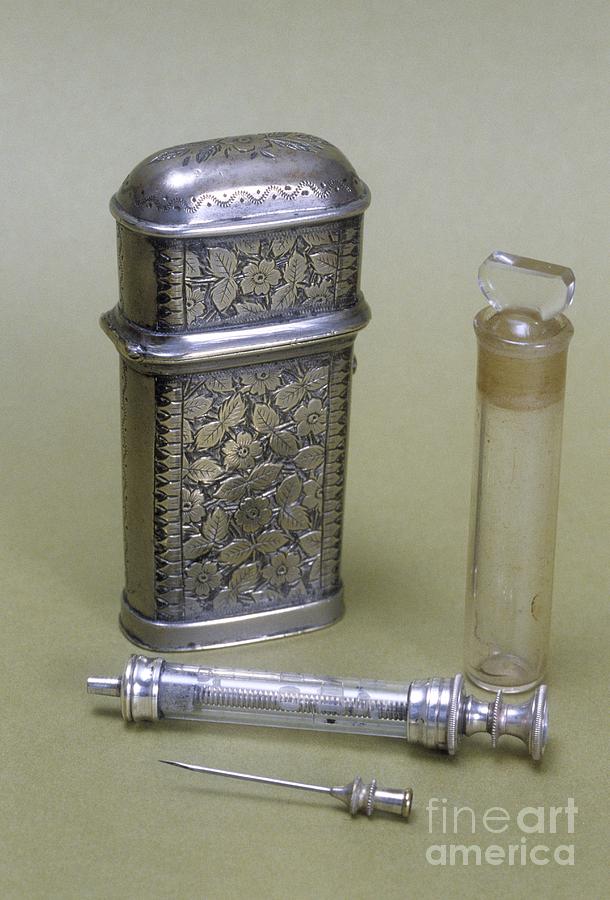
Where is `glass container`? glass container is located at coordinates (535, 362), (515, 462), (515, 594), (504, 653).